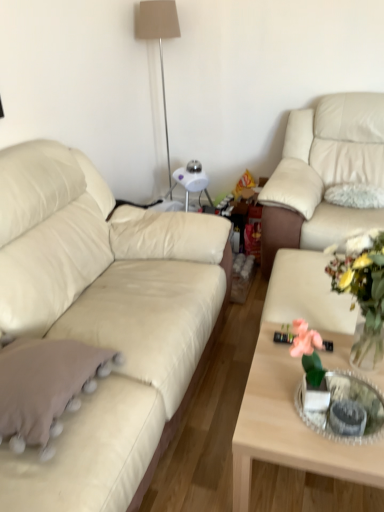
Question: Considering the relative sizes of light wood coffee table at center and translucent glass vase at center in the image provided, is light wood coffee table at center wider than translucent glass vase at center?

Choices:
 (A) yes
 (B) no

Answer: (A)

Question: Is the depth of light wood coffee table at center less than that of translucent glass vase at center?

Choices:
 (A) yes
 (B) no

Answer: (B)

Question: Does light wood coffee table at center have a lesser height compared to translucent glass vase at center?

Choices:
 (A) yes
 (B) no

Answer: (A)

Question: Is translucent glass vase at center a part of light wood coffee table at center?

Choices:
 (A) yes
 (B) no

Answer: (B)

Question: Could you tell me if light wood coffee table at center is facing translucent glass vase at center?

Choices:
 (A) no
 (B) yes

Answer: (A)

Question: From the image's perspective, would you say light wood coffee table at center is shown under translucent glass vase at center?

Choices:
 (A) yes
 (B) no

Answer: (A)

Question: Considering the relative sizes of matte beige lampshade at upper center and beige leather couch at left, which is counted as the 1th studio couch, starting from the left, in the image provided, is matte beige lampshade at upper center bigger than beige leather couch at left, which is counted as the 1th studio couch, starting from the left,?

Choices:
 (A) yes
 (B) no

Answer: (B)

Question: Is matte beige lampshade at upper center looking in the opposite direction of beige leather couch at left, which is counted as the 1th studio couch, starting from the left?

Choices:
 (A) yes
 (B) no

Answer: (B)

Question: Does matte beige lampshade at upper center have a lesser height compared to beige leather couch at left, which is counted as the 1th studio couch, starting from the left?

Choices:
 (A) no
 (B) yes

Answer: (A)

Question: From a real-world perspective, does matte beige lampshade at upper center sit lower than beige leather couch at left, the 2th studio couch when ordered from right to left?

Choices:
 (A) yes
 (B) no

Answer: (B)

Question: Would you say matte beige lampshade at upper center is outside beige leather couch at left, which is counted as the 1th studio couch, starting from the left?

Choices:
 (A) no
 (B) yes

Answer: (B)

Question: From the image's perspective, would you say matte beige lampshade at upper center is positioned over beige leather couch at left, the 2th studio couch when ordered from right to left?

Choices:
 (A) no
 (B) yes

Answer: (B)

Question: Is beige leather couch at left, the 2th studio couch when ordered from right to left, positioned before matte beige lampshade at upper center?

Choices:
 (A) no
 (B) yes

Answer: (B)